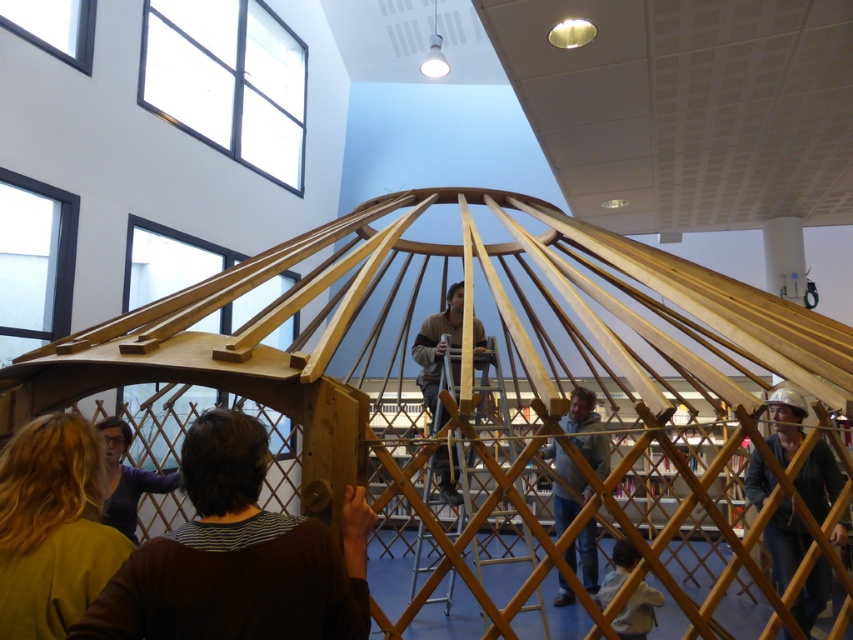
Can you confirm if wooden ladder at center is positioned to the left of matte purple sweater at lower left?

Incorrect, wooden ladder at center is not on the left side of matte purple sweater at lower left.

What do you see at coordinates (437, 342) in the screenshot? I see `wooden ladder at center` at bounding box center [437, 342].

Locate an element on the screen. wooden ladder at center is located at coordinates (437, 342).

Can you confirm if brown striped shirt at center is positioned to the left of light blue hoodie at center?

Indeed, brown striped shirt at center is positioned on the left side of light blue hoodie at center.

Which is in front, point (155, 618) or point (572, 552)?

Point (155, 618) is more forward.

Find the location of a particular element. brown striped shirt at center is located at coordinates (236, 557).

Can you confirm if light blue hoodie at center is shorter than matte purple sweater at lower left?

No.

The image size is (853, 640). What are the coordinates of `light blue hoodie at center` in the screenshot? It's located at (585, 556).

This screenshot has width=853, height=640. What are the coordinates of `light blue hoodie at center` in the screenshot? It's located at (585, 556).